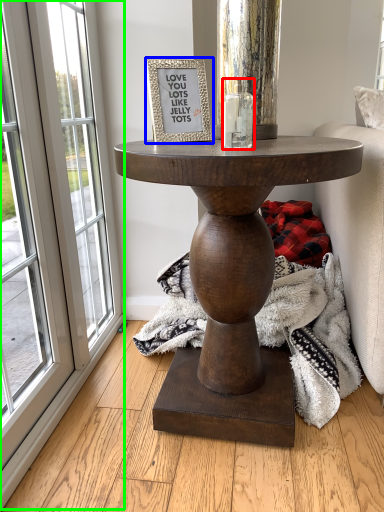
Question: Based on their relative distances, which object is farther from candle holder (highlighted by a red box)? Choose from picture frame (highlighted by a blue box) and screen door (highlighted by a green box).

Choices:
 (A) picture frame
 (B) screen door

Answer: (B)